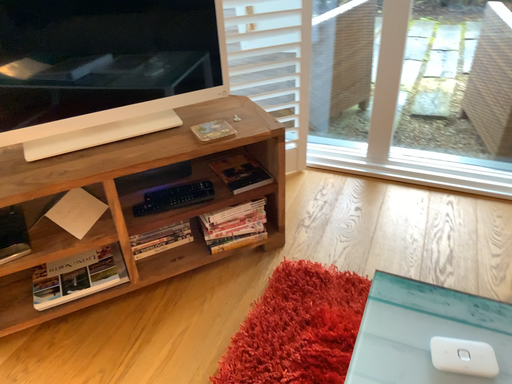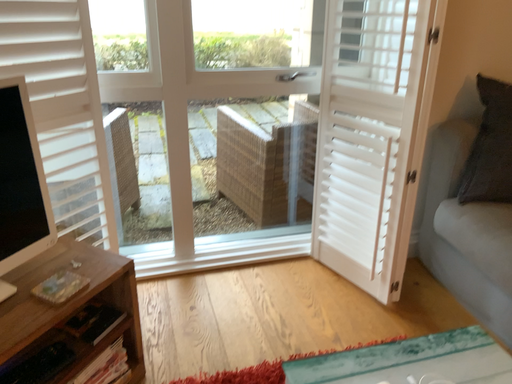
Question: How did the camera likely rotate when shooting the video?

Choices:
 (A) rotated left
 (B) rotated right

Answer: (B)